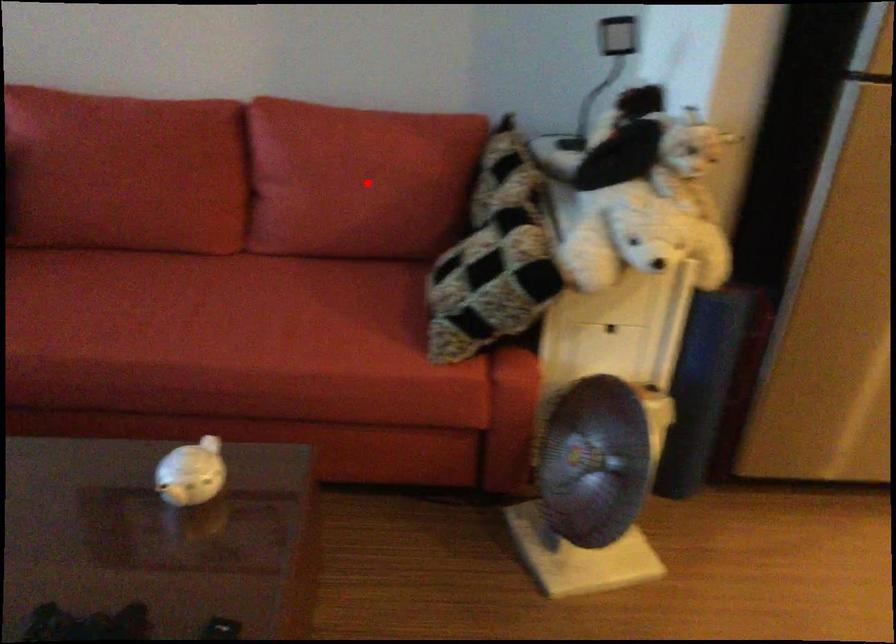
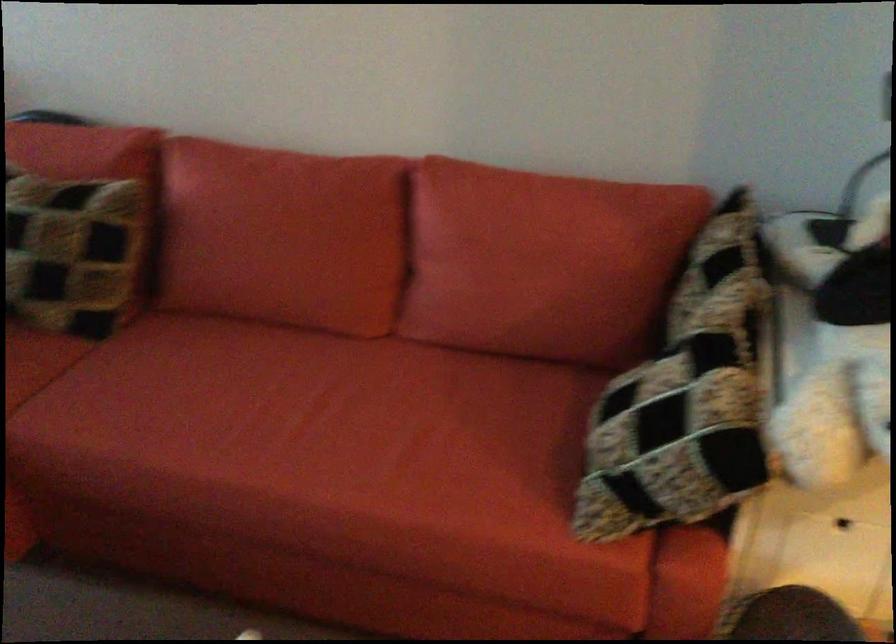
Locate, in the second image, the point that corresponds to the highlighted location in the first image.

(538, 270)